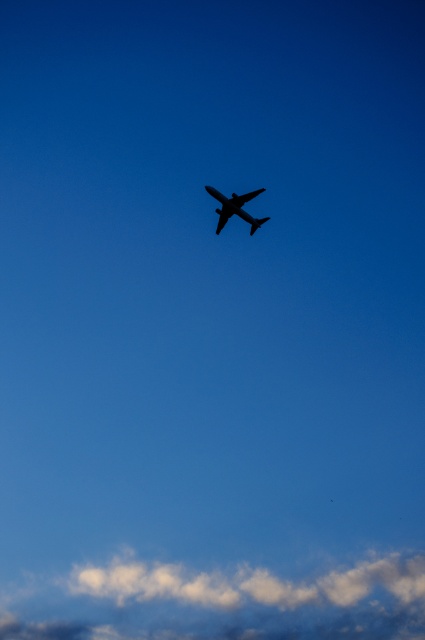
Between white fluffy cloud at lower center and black matte airplane at center, which one is positioned higher?

black matte airplane at center is higher up.

Is point (102, 625) behind point (234, 209)?

Yes.

This screenshot has height=640, width=425. Find the location of `white fluffy cloud at lower center`. white fluffy cloud at lower center is located at coordinates (221, 602).